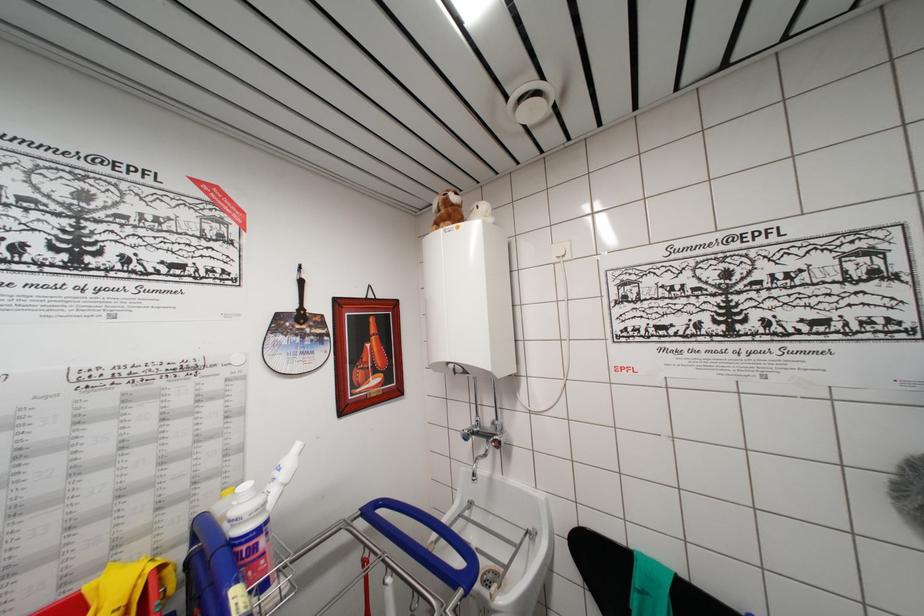
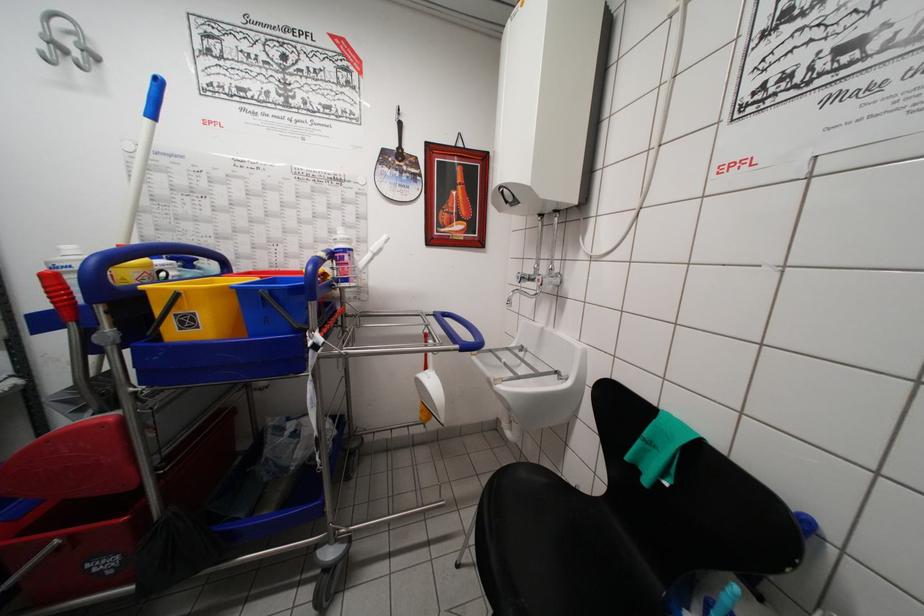
In the second image, find the point that corresponds to point (286, 480) in the first image.

(377, 253)